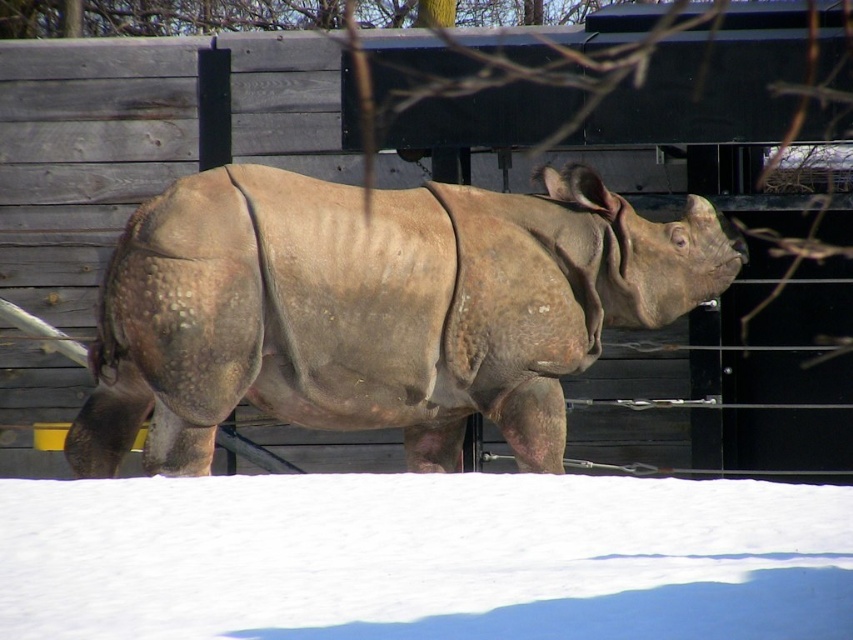
Consider the image. You are a zookeeper who needs to clear snow from the path leading to the rhino enclosure. The path is represented by the white powder snow at lower center. If the gray textured rhino at center is blocking the path, can you determine which side of the snow to start shoveling first?

The gray textured rhino at center is positioned on the left side of white powder snow at lower center. Therefore, you should start shoveling the right side of the snow first to clear the path around the rhino.

You are a zookeeper planning to feed the gray textured rhino at center. You have a bucket of food placed on the white powder snow at lower center. Can you reach the bucket without stepping on the snow?

The gray textured rhino at center is above the white powder snow at lower center, which means the snow is below the rhino. Since the bucket is on the snow, you can reach it by moving towards the lower area where the snow is located without needing to step on the snow itself.